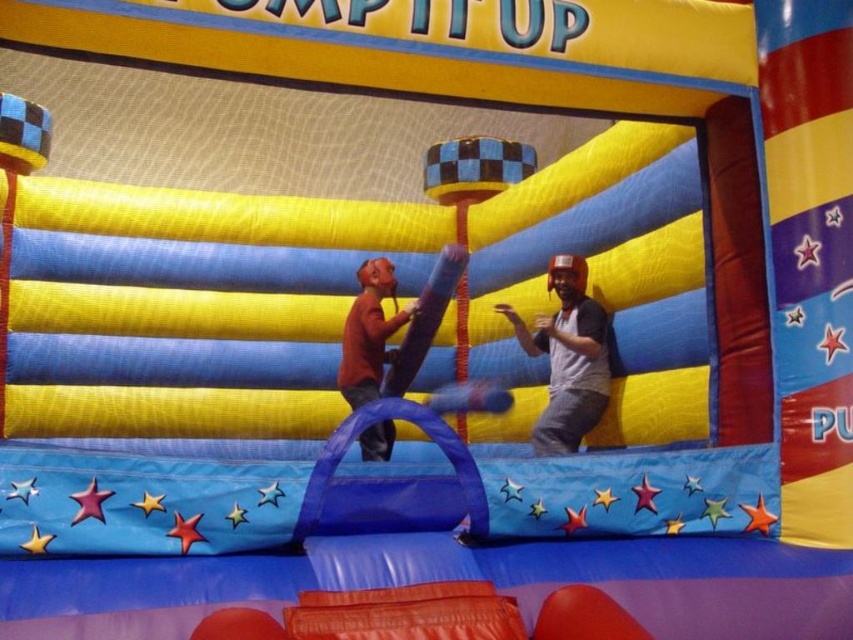
Question: Is gray matte helmet at upper right positioned at the back of matte brown shirt at center?

Choices:
 (A) no
 (B) yes

Answer: (A)

Question: Is gray matte helmet at upper right to the right of matte brown shirt at center from the viewer's perspective?

Choices:
 (A) no
 (B) yes

Answer: (B)

Question: Among these objects, which one is nearest to the camera?

Choices:
 (A) matte brown shirt at center
 (B) gray matte helmet at upper right

Answer: (B)

Question: Does gray matte helmet at upper right have a smaller size compared to matte brown shirt at center?

Choices:
 (A) yes
 (B) no

Answer: (B)

Question: Which point is farther to the camera?

Choices:
 (A) matte brown shirt at center
 (B) gray matte helmet at upper right

Answer: (A)

Question: Which of the following is the closest to the observer?

Choices:
 (A) (392, 444)
 (B) (593, 374)

Answer: (B)